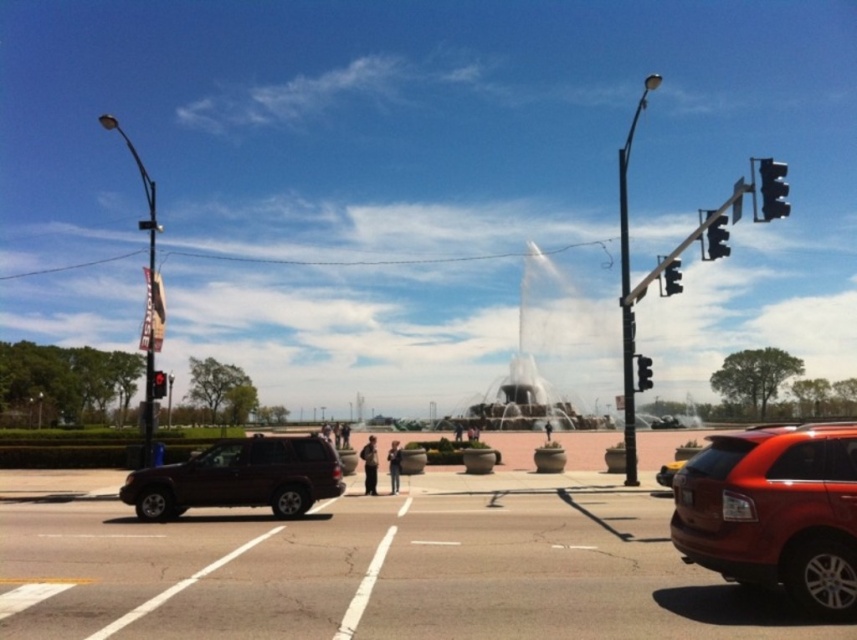
Is the position of matte black suv at center more distant than that of dark gray fabric jacket at center?

No, it is in front of dark gray fabric jacket at center.

Image resolution: width=857 pixels, height=640 pixels. Describe the element at coordinates (238, 477) in the screenshot. I see `matte black suv at center` at that location.

Identify the location of matte black suv at center. (238, 477).

Find the location of a particular element. metallic traffic light at center right is located at coordinates (643, 372).

Who is more distant from viewer, (651, 360) or (454, 422)?

The point (454, 422) is more distant.

Image resolution: width=857 pixels, height=640 pixels. In order to click on metallic traffic light at center right in this screenshot , I will do coord(643,372).

Consider the image. Does dark gray fabric jacket at center appear under metallic traffic light at center right?

Yes.

Does dark gray fabric jacket at center appear on the right side of metallic traffic light at center right?

In fact, dark gray fabric jacket at center is to the left of metallic traffic light at center right.

Who is more distant from viewer, (391, 486) or (640, 364)?

The point (391, 486) is more distant.

This screenshot has width=857, height=640. I want to click on dark gray fabric jacket at center, so click(394, 465).